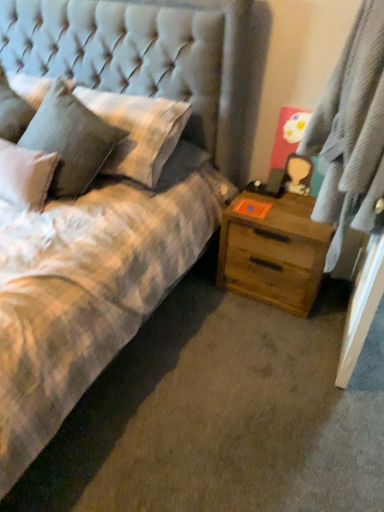
Question: Is textured gray pillow at upper left, placed as the 2th pillow when sorted from left to right, shorter than tufted fabric headboard at upper left?

Choices:
 (A) no
 (B) yes

Answer: (B)

Question: Does textured gray pillow at upper left, the 1th pillow viewed from the right, have a smaller size compared to tufted fabric headboard at upper left?

Choices:
 (A) yes
 (B) no

Answer: (A)

Question: Is textured gray pillow at upper left, placed as the 2th pillow when sorted from left to right, bigger than tufted fabric headboard at upper left?

Choices:
 (A) no
 (B) yes

Answer: (A)

Question: Is textured gray pillow at upper left, the 1th pillow viewed from the right, further to the viewer compared to tufted fabric headboard at upper left?

Choices:
 (A) yes
 (B) no

Answer: (A)

Question: Is textured gray pillow at upper left, placed as the 2th pillow when sorted from left to right, positioned with its back to tufted fabric headboard at upper left?

Choices:
 (A) yes
 (B) no

Answer: (A)

Question: Is tufted fabric headboard at upper left surrounded by textured gray pillow at upper left, placed as the 2th pillow when sorted from left to right?

Choices:
 (A) no
 (B) yes

Answer: (A)

Question: Is gray textured curtain at right not inside fluffy white pillow at upper left, which appears as the first pillow when viewed from the left?

Choices:
 (A) yes
 (B) no

Answer: (A)

Question: Does gray textured curtain at right appear on the left side of fluffy white pillow at upper left, acting as the second pillow starting from the right?

Choices:
 (A) no
 (B) yes

Answer: (A)

Question: From a real-world perspective, is gray textured curtain at right located higher than fluffy white pillow at upper left, acting as the second pillow starting from the right?

Choices:
 (A) no
 (B) yes

Answer: (B)

Question: Does gray textured curtain at right have a greater width compared to fluffy white pillow at upper left, which appears as the first pillow when viewed from the left?

Choices:
 (A) no
 (B) yes

Answer: (A)

Question: Can you confirm if gray textured curtain at right is bigger than fluffy white pillow at upper left, which appears as the first pillow when viewed from the left?

Choices:
 (A) no
 (B) yes

Answer: (B)

Question: Can you confirm if gray textured curtain at right is taller than fluffy white pillow at upper left, acting as the second pillow starting from the right?

Choices:
 (A) yes
 (B) no

Answer: (A)

Question: Can you confirm if wooden nightstand at right is positioned to the left of fluffy white pillow at upper left, which appears as the first pillow when viewed from the left?

Choices:
 (A) no
 (B) yes

Answer: (A)